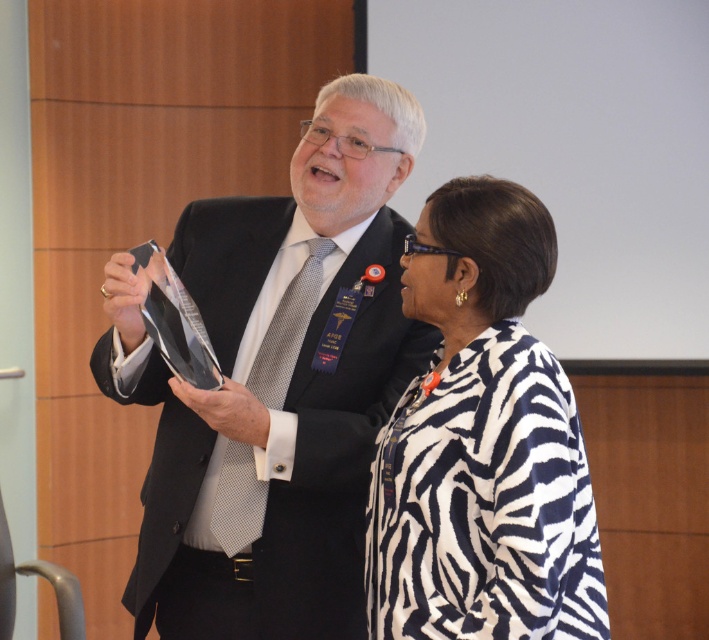
Question: Which point is closer to the camera?

Choices:
 (A) (518, 248)
 (B) (262, 392)

Answer: (A)

Question: Which point is closer to the camera?

Choices:
 (A) matte black suit at center
 (B) gray dotted tie at center
 (C) zebra-patterned jacket at center-right

Answer: (C)

Question: Does zebra-patterned jacket at center-right appear under gray dotted tie at center?

Choices:
 (A) no
 (B) yes

Answer: (B)

Question: Can you confirm if matte black suit at center is wider than zebra-patterned jacket at center-right?

Choices:
 (A) no
 (B) yes

Answer: (B)

Question: Which object is closer to the camera taking this photo?

Choices:
 (A) zebra-patterned jacket at center-right
 (B) matte black suit at center
 (C) gray dotted tie at center

Answer: (A)

Question: Can you confirm if matte black suit at center is bigger than gray dotted tie at center?

Choices:
 (A) no
 (B) yes

Answer: (B)